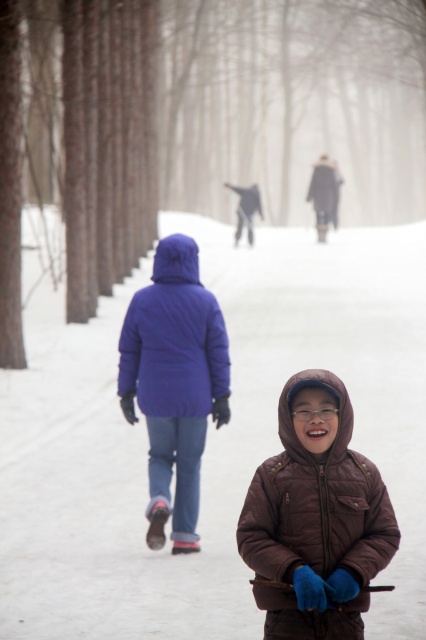
You are a photographer trying to capture the child in the scene. If you want to ensure both the brown quilted jacket at center and the matte blue jacket at center are fully visible in the photo, which jacket should you focus on to frame the shot appropriately?

You should focus on the matte blue jacket at center because it is taller than the brown quilted jacket at center, ensuring both are fully visible when framing the shot.

You are a photographer trying to capture the winter scene. You notice two points in the image at coordinates point (307, 520) and point (172, 291). Which point is nearer to your camera lens?

Point (307, 520) is closer to the camera than point (172, 291).

You are a photographer trying to capture the child in the center of the image. You notice two jackets, the brown quilted jacket at center and the matte blue jacket at center. Which jacket should you focus on to ensure the child is centered in your shot?

The brown quilted jacket at center is positioned on the right side of the matte blue jacket at center. To center the child, focus on the matte blue jacket at center since it is closer to the center point between the two jackets.